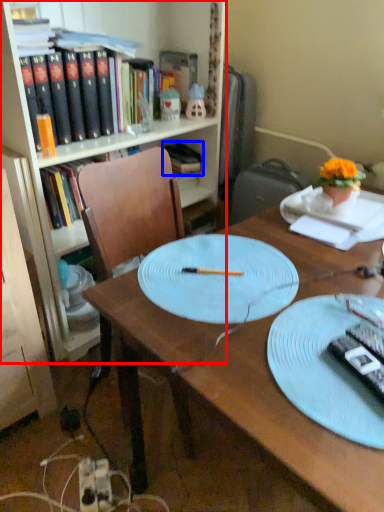
Question: Among these objects, which one is nearest to the camera, bookcase (highlighted by a red box) or book (highlighted by a blue box)?

Choices:
 (A) bookcase
 (B) book

Answer: (A)